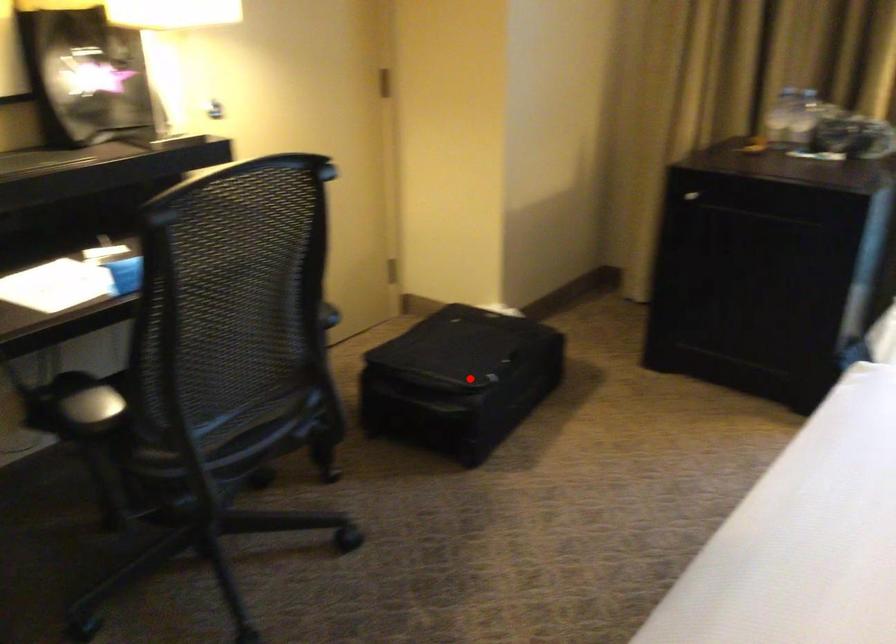
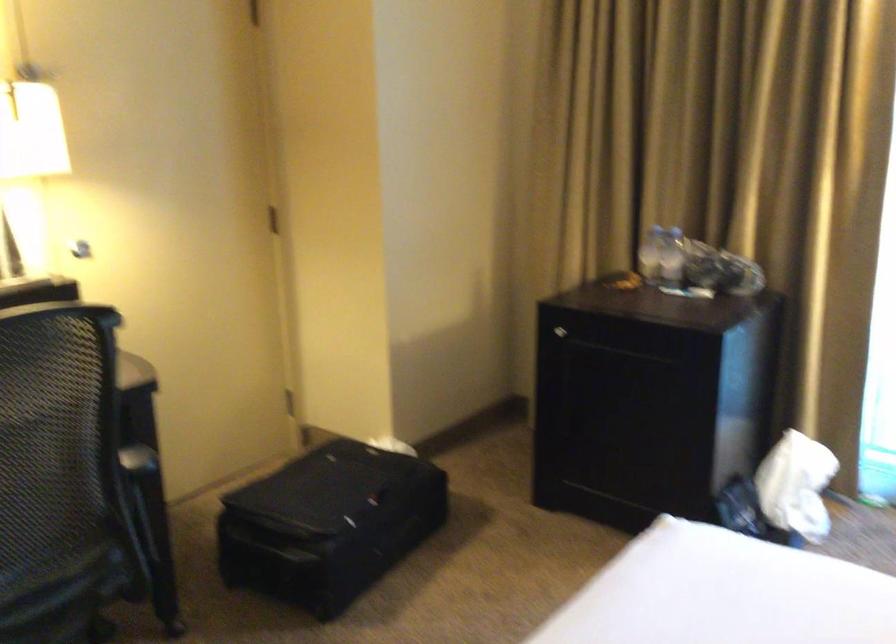
Where in the second image is the point corresponding to the highlighted location from the first image?

(328, 524)